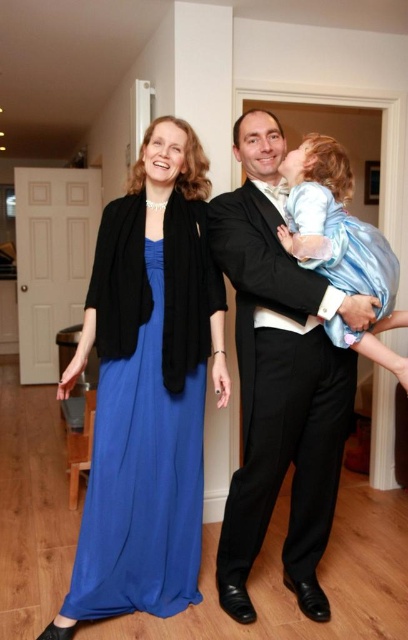
You are standing at the point marked as point (164, 288) in the hallway. If you want to take a photo of the closed door in the background, which direction should you move to ensure the camera captures the door clearly?

You should move towards the closed door in the background because the point (164, 288) is 6.72 feet away from the camera, so moving closer to the door will position you in a better angle to capture it clearly.

You are a photographer standing in the hallway. You need to capture a photo that includes both the blue silk dress at left and the shiny black suit at center. What is the minimum distance you should maintain between the camera and the subjects to ensure both are in frame?

The blue silk dress at left and the shiny black suit at center are 33.02 centimeters apart. To ensure both are in frame, the photographer should position the camera at least 33.02 centimeters away from the closest subject.